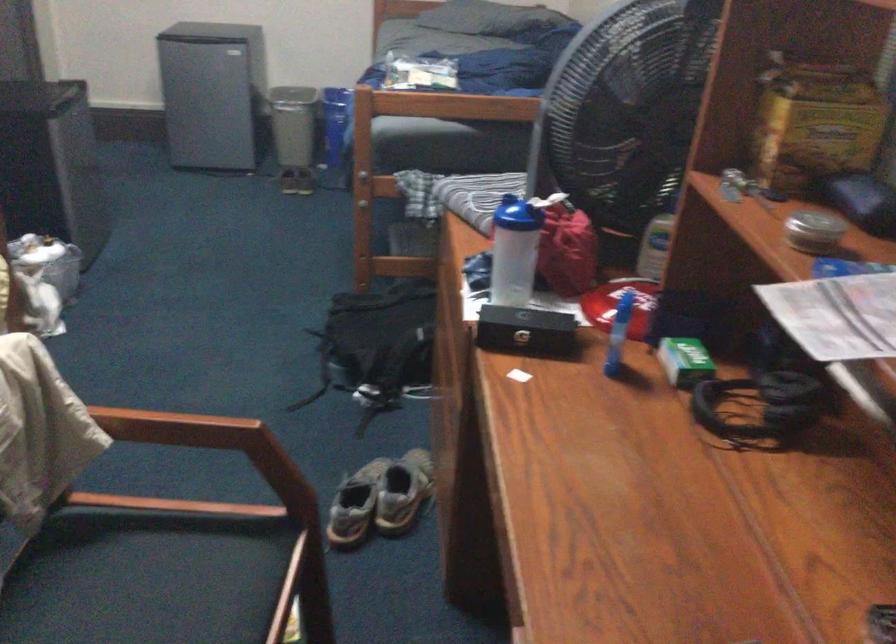
What do you see at coordinates (510, 214) in the screenshot?
I see `the blue bottle lid` at bounding box center [510, 214].